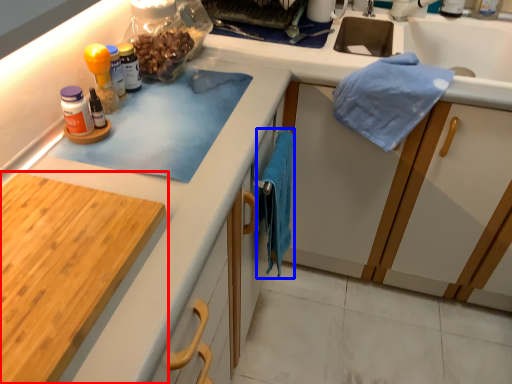
Question: Which object is closer to the camera taking this photo, cabinetry (highlighted by a red box) or bath towel (highlighted by a blue box)?

Choices:
 (A) cabinetry
 (B) bath towel

Answer: (A)